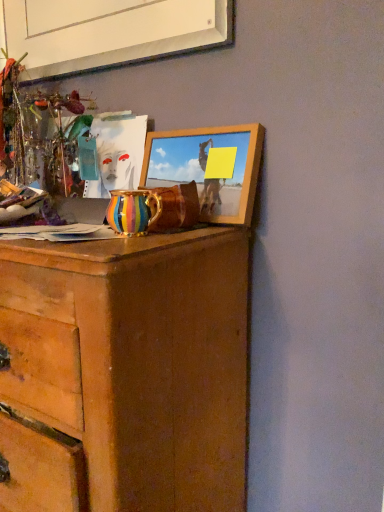
Identify the location of white matte picture frame at upper center, which is counted as the second picture frame, starting from the bottom. The width and height of the screenshot is (384, 512). (110, 33).

Image resolution: width=384 pixels, height=512 pixels. What do you see at coordinates (132, 211) in the screenshot?
I see `multicolored ceramic vase at center` at bounding box center [132, 211].

In order to click on multicolored ceramic vase at center in this screenshot , I will do `click(132, 211)`.

This screenshot has height=512, width=384. What do you see at coordinates (137, 362) in the screenshot? I see `wooden chest of drawers at center` at bounding box center [137, 362].

Find the location of a particular element. white matte picture frame at upper center, the 1th picture frame from the top is located at coordinates (110, 33).

From the picture: Is multicolored ceramic vase at center located outside wooden picture frame at upper center, arranged as the 1th picture frame when ordered from the bottom?

multicolored ceramic vase at center lies outside wooden picture frame at upper center, arranged as the 1th picture frame when ordered from the bottom,'s area.

From a real-world perspective, starting from the multicolored ceramic vase at center, which picture frame is the 1st one vertically above it? Please provide its 2D coordinates.

[(209, 168)]

Between multicolored ceramic vase at center and wooden picture frame at upper center, arranged as the 1th picture frame when ordered from the bottom, which one has less height?

multicolored ceramic vase at center.

Which of these two, multicolored ceramic vase at center or wooden picture frame at upper center, which is counted as the second picture frame, starting from the top, is bigger?

With larger size is wooden picture frame at upper center, which is counted as the second picture frame, starting from the top.

From a real-world perspective, is wooden chest of drawers at center above or below white matte picture frame at upper center, the 1th picture frame from the top?

wooden chest of drawers at center is below white matte picture frame at upper center, the 1th picture frame from the top.

Does wooden chest of drawers at center come in front of white matte picture frame at upper center, the 1th picture frame from the top?

That is True.

Could white matte picture frame at upper center, the 1th picture frame from the top, be considered to be inside wooden chest of drawers at center?

No, white matte picture frame at upper center, the 1th picture frame from the top, is located outside of wooden chest of drawers at center.

Locate an element on the screen. the chest of drawers that is under the white matte picture frame at upper center, the 1th picture frame from the top (from a real-world perspective) is located at coordinates (137, 362).

From the image's perspective, is white matte picture frame at upper center, the 1th picture frame from the top, located above or below wooden chest of drawers at center?

white matte picture frame at upper center, the 1th picture frame from the top, is situated higher than wooden chest of drawers at center in the image.

Which object is positioned more to the left, white matte picture frame at upper center, the 1th picture frame from the top, or wooden chest of drawers at center?

wooden chest of drawers at center is more to the left.

Consider the image. Is white matte picture frame at upper center, which is counted as the second picture frame, starting from the bottom, facing towards wooden chest of drawers at center?

No, white matte picture frame at upper center, which is counted as the second picture frame, starting from the bottom, is not turned towards wooden chest of drawers at center.

Choose the correct answer: Is white matte picture frame at upper center, which is counted as the second picture frame, starting from the bottom, inside wooden chest of drawers at center or outside it?

The correct answer is: outside.

From the image's perspective, which is above, wooden chest of drawers at center or multicolored ceramic vase at center?

multicolored ceramic vase at center appears higher in the image.

Can you confirm if wooden chest of drawers at center is positioned to the left of multicolored ceramic vase at center?

Yes.

Do you think wooden chest of drawers at center is within multicolored ceramic vase at center, or outside of it?

wooden chest of drawers at center is not inside multicolored ceramic vase at center, it's outside.

Is point (234, 425) behind point (129, 229)?

Yes, point (234, 425) is behind point (129, 229).

Who is smaller, multicolored ceramic vase at center or wooden chest of drawers at center?

Smaller between the two is multicolored ceramic vase at center.

Would you consider multicolored ceramic vase at center to be distant from wooden chest of drawers at center?

multicolored ceramic vase at center is near wooden chest of drawers at center, not far away.

How much distance is there between multicolored ceramic vase at center and wooden chest of drawers at center?

10.47 inches.

Is multicolored ceramic vase at center outside of wooden chest of drawers at center?

Absolutely, multicolored ceramic vase at center is external to wooden chest of drawers at center.

Is white matte picture frame at upper center, the 1th picture frame from the top, closer to the viewer compared to wooden picture frame at upper center, which is counted as the second picture frame, starting from the top?

No.

Are white matte picture frame at upper center, the 1th picture frame from the top, and wooden picture frame at upper center, arranged as the 1th picture frame when ordered from the bottom, far apart?

No, white matte picture frame at upper center, the 1th picture frame from the top, is not far from wooden picture frame at upper center, arranged as the 1th picture frame when ordered from the bottom.

Who is taller, white matte picture frame at upper center, the 1th picture frame from the top, or wooden picture frame at upper center, which is counted as the second picture frame, starting from the top?

wooden picture frame at upper center, which is counted as the second picture frame, starting from the top, is taller.

You are a GUI agent. You are given a task and a screenshot of the screen. Output one action in this format:
    pyautogui.click(x=<x>, y=<y>)
    Task: Click on the picture frame to the left of wooden picture frame at upper center, arranged as the 1th picture frame when ordered from the bottom
    The height and width of the screenshot is (512, 384).
    Given the screenshot: What is the action you would take?
    pyautogui.click(x=110, y=33)

From a real-world perspective, is wooden picture frame at upper center, which is counted as the second picture frame, starting from the top, below wooden chest of drawers at center?

No, from a real-world perspective, wooden picture frame at upper center, which is counted as the second picture frame, starting from the top, is not below wooden chest of drawers at center.

From the image's perspective, is wooden picture frame at upper center, arranged as the 1th picture frame when ordered from the bottom, under wooden chest of drawers at center?

Incorrect, from the image's perspective, wooden picture frame at upper center, arranged as the 1th picture frame when ordered from the bottom, is higher than wooden chest of drawers at center.

From their relative heights in the image, would you say wooden picture frame at upper center, which is counted as the second picture frame, starting from the top, is taller or shorter than wooden chest of drawers at center?

In the image, wooden picture frame at upper center, which is counted as the second picture frame, starting from the top, appears to be shorter than wooden chest of drawers at center.

This screenshot has width=384, height=512. What are the coordinates of `the chest of drawers lying in front of the wooden picture frame at upper center, arranged as the 1th picture frame when ordered from the bottom` in the screenshot? It's located at (137, 362).

Locate an element on the screen. This screenshot has width=384, height=512. vase below the wooden picture frame at upper center, which is counted as the second picture frame, starting from the top (from a real-world perspective) is located at coordinates (132, 211).

Find the location of `the chest of drawers in front of the white matte picture frame at upper center, which is counted as the second picture frame, starting from the bottom`. the chest of drawers in front of the white matte picture frame at upper center, which is counted as the second picture frame, starting from the bottom is located at coordinates (137, 362).

When comparing their distances from wooden chest of drawers at center, does white matte picture frame at upper center, the 1th picture frame from the top, or wooden picture frame at upper center, which is counted as the second picture frame, starting from the top, seem further?

white matte picture frame at upper center, the 1th picture frame from the top, is positioned further to the anchor wooden chest of drawers at center.

When comparing their distances from wooden chest of drawers at center, does wooden picture frame at upper center, which is counted as the second picture frame, starting from the top, or multicolored ceramic vase at center seem further?

Based on the image, wooden picture frame at upper center, which is counted as the second picture frame, starting from the top, appears to be further to wooden chest of drawers at center.

Based on their spatial positions, is wooden chest of drawers at center or multicolored ceramic vase at center further from wooden picture frame at upper center, arranged as the 1th picture frame when ordered from the bottom?

Among the two, wooden chest of drawers at center is located further to wooden picture frame at upper center, arranged as the 1th picture frame when ordered from the bottom.

Based on their spatial positions, is wooden picture frame at upper center, which is counted as the second picture frame, starting from the top, or white matte picture frame at upper center, the 1th picture frame from the top, closer to wooden chest of drawers at center?

wooden picture frame at upper center, which is counted as the second picture frame, starting from the top.

Which object lies nearer to the anchor point wooden chest of drawers at center, multicolored ceramic vase at center or white matte picture frame at upper center, the 1th picture frame from the top?

multicolored ceramic vase at center.

Considering their positions, is white matte picture frame at upper center, the 1th picture frame from the top, positioned further to wooden picture frame at upper center, arranged as the 1th picture frame when ordered from the bottom, than wooden chest of drawers at center?

Based on the image, white matte picture frame at upper center, the 1th picture frame from the top, appears to be further to wooden picture frame at upper center, arranged as the 1th picture frame when ordered from the bottom.

From the image, which object appears to be nearer to wooden picture frame at upper center, arranged as the 1th picture frame when ordered from the bottom, multicolored ceramic vase at center or wooden chest of drawers at center?

multicolored ceramic vase at center is positioned closer to the anchor wooden picture frame at upper center, arranged as the 1th picture frame when ordered from the bottom.

Estimate the real-world distances between objects in this image. Which object is closer to wooden chest of drawers at center, white matte picture frame at upper center, which is counted as the second picture frame, starting from the bottom, or multicolored ceramic vase at center?

Among the two, multicolored ceramic vase at center is located nearer to wooden chest of drawers at center.

This screenshot has height=512, width=384. I want to click on picture frame between white matte picture frame at upper center, which is counted as the second picture frame, starting from the bottom, and wooden chest of drawers at center from top to bottom, so click(x=209, y=168).

I want to click on vase that lies between wooden picture frame at upper center, arranged as the 1th picture frame when ordered from the bottom, and wooden chest of drawers at center from top to bottom, so click(132, 211).

I want to click on picture frame between white matte picture frame at upper center, which is counted as the second picture frame, starting from the bottom, and multicolored ceramic vase at center from top to bottom, so click(x=209, y=168).

Find the location of `vase between white matte picture frame at upper center, the 1th picture frame from the top, and wooden chest of drawers at center vertically`. vase between white matte picture frame at upper center, the 1th picture frame from the top, and wooden chest of drawers at center vertically is located at coordinates (132, 211).